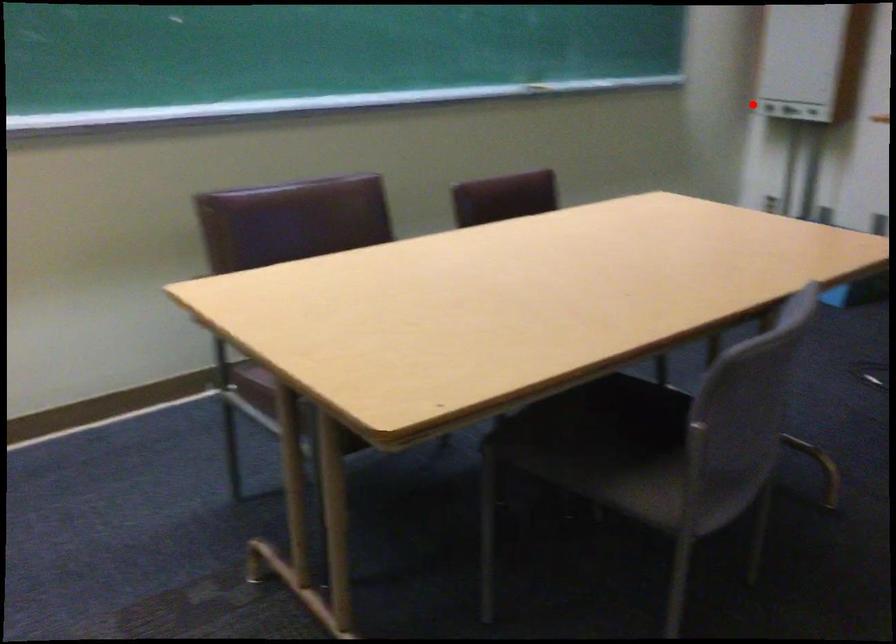
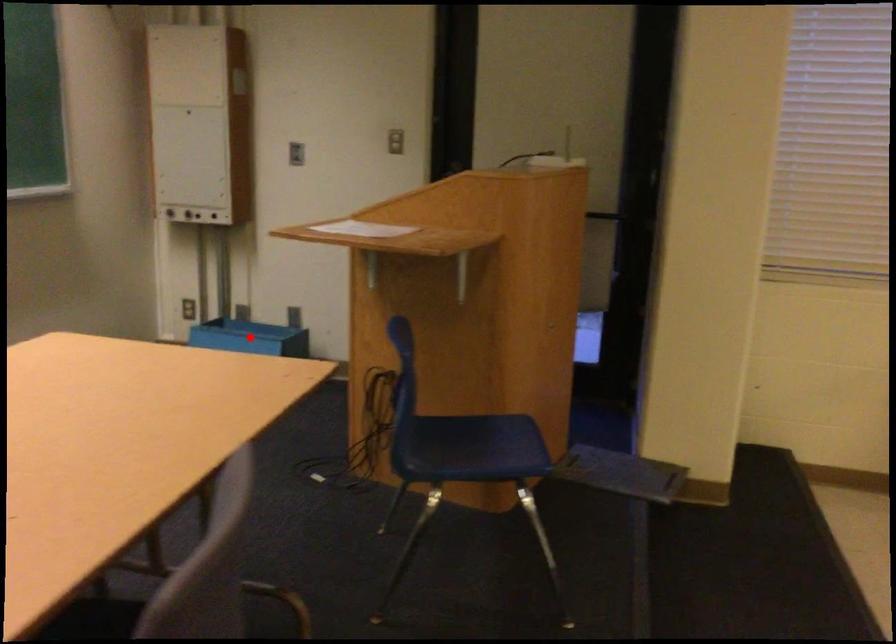
I am providing you with two images of the same scene from different viewpoints. A red point is marked on the first image and another point is marked on the second image. Does the point marked in image1 correspond to the same location as the one in image2?

No